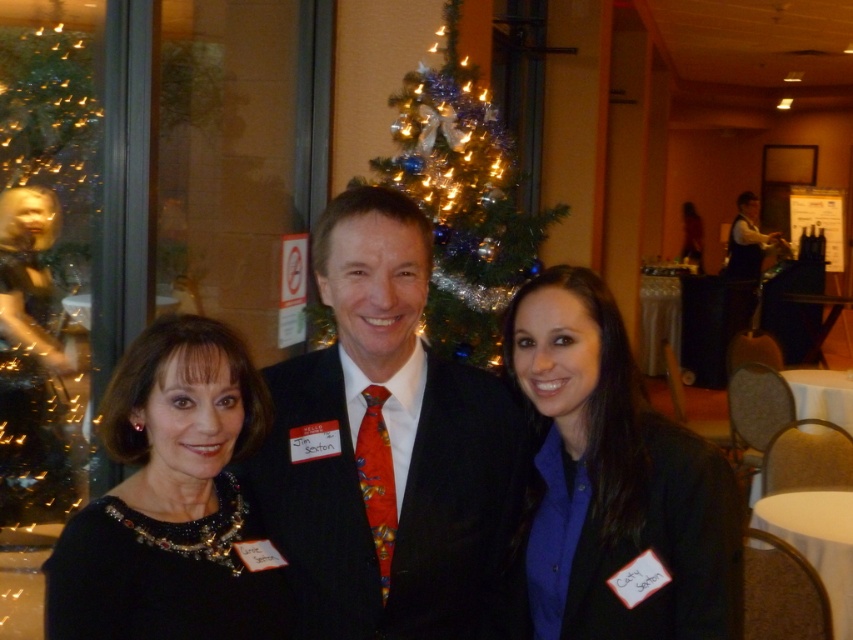
You are a photographer adjusting your camera settings. You notice the black matte jacket at center and the white cloth table at center in your frame. Which object should you focus on first to ensure sharpness, given their positions?

The black matte jacket at center is closer to the viewer than the white cloth table at center, so focusing on the black matte jacket at center first will ensure sharpness due to its proximity.